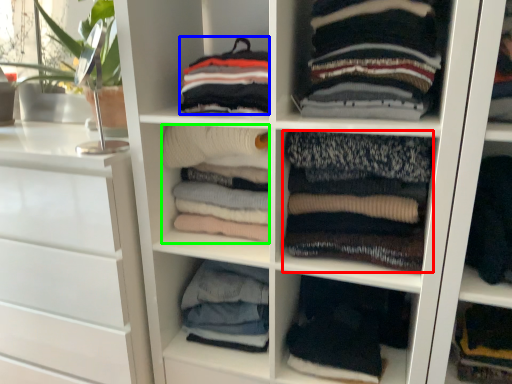
Question: Considering the real-world distances, which object is closest to clothing (highlighted by a red box)? clothing (highlighted by a blue box) or clothing (highlighted by a green box).

Choices:
 (A) clothing
 (B) clothing

Answer: (B)